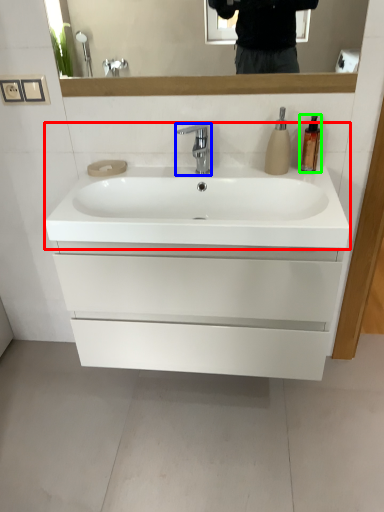
Question: Which object is the farthest from sink (highlighted by a red box)? Choose among these: tap (highlighted by a blue box) or soap dispenser (highlighted by a green box).

Choices:
 (A) tap
 (B) soap dispenser

Answer: (B)